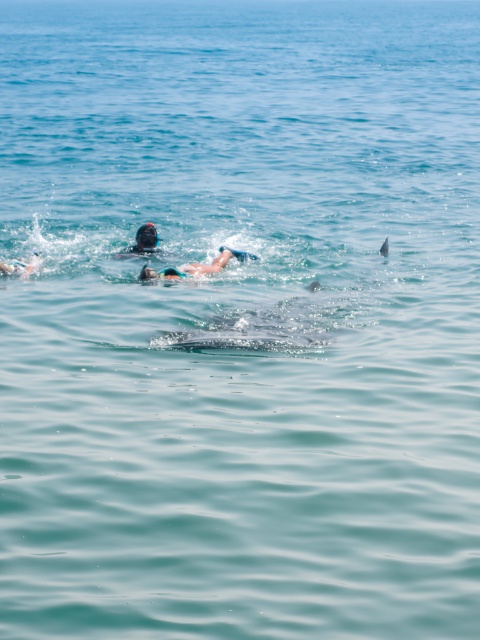
Question: Which object appears farthest from the camera in this image?

Choices:
 (A) matte black snorkel at upper center
 (B) smooth white swimmer at left
 (C) blue matte swimsuit at center

Answer: (A)

Question: Which of these objects is positioned closest to the smooth white swimmer at left?

Choices:
 (A) matte black snorkel at upper center
 (B) blue matte swimsuit at center

Answer: (A)

Question: Does blue matte swimsuit at center appear on the left side of smooth white swimmer at left?

Choices:
 (A) yes
 (B) no

Answer: (B)

Question: Where is blue matte swimsuit at center located in relation to matte black snorkel at upper center in the image?

Choices:
 (A) right
 (B) left

Answer: (A)

Question: Does matte black snorkel at upper center appear over smooth white swimmer at left?

Choices:
 (A) yes
 (B) no

Answer: (A)

Question: Which of the following is the farthest from the observer?

Choices:
 (A) (16, 269)
 (B) (142, 275)

Answer: (A)